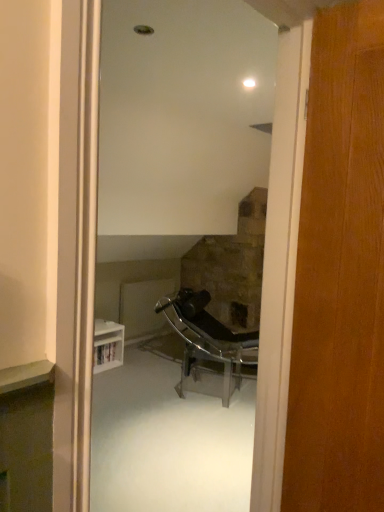
Question: Is the depth of metallic chrome chair at center less than that of wooden door at right?

Choices:
 (A) no
 (B) yes

Answer: (A)

Question: Can you confirm if metallic chrome chair at center is wider than wooden door at right?

Choices:
 (A) no
 (B) yes

Answer: (B)

Question: From the image's perspective, does metallic chrome chair at center appear higher than wooden door at right?

Choices:
 (A) no
 (B) yes

Answer: (A)

Question: Does metallic chrome chair at center have a greater height compared to wooden door at right?

Choices:
 (A) no
 (B) yes

Answer: (A)

Question: From a real-world perspective, is metallic chrome chair at center positioned under wooden door at right based on gravity?

Choices:
 (A) no
 (B) yes

Answer: (B)

Question: Considering the relative positions of metallic chrome chair at center and wooden door at right in the image provided, is metallic chrome chair at center to the right of wooden door at right from the viewer's perspective?

Choices:
 (A) no
 (B) yes

Answer: (A)

Question: Is there a large distance between wooden door at right and metallic chrome chair at center?

Choices:
 (A) no
 (B) yes

Answer: (B)

Question: Does wooden door at right have a larger size compared to metallic chrome chair at center?

Choices:
 (A) no
 (B) yes

Answer: (A)

Question: Is wooden door at right completely or partially outside of metallic chrome chair at center?

Choices:
 (A) no
 (B) yes

Answer: (B)

Question: Could you tell me if wooden door at right is turned towards metallic chrome chair at center?

Choices:
 (A) no
 (B) yes

Answer: (A)

Question: Can you confirm if wooden door at right is taller than metallic chrome chair at center?

Choices:
 (A) no
 (B) yes

Answer: (B)

Question: Considering the relative positions of wooden door at right and metallic chrome chair at center in the image provided, is wooden door at right behind metallic chrome chair at center?

Choices:
 (A) no
 (B) yes

Answer: (A)

Question: Based on their positions, is wooden door at right located to the left or right of metallic chrome chair at center?

Choices:
 (A) left
 (B) right

Answer: (B)